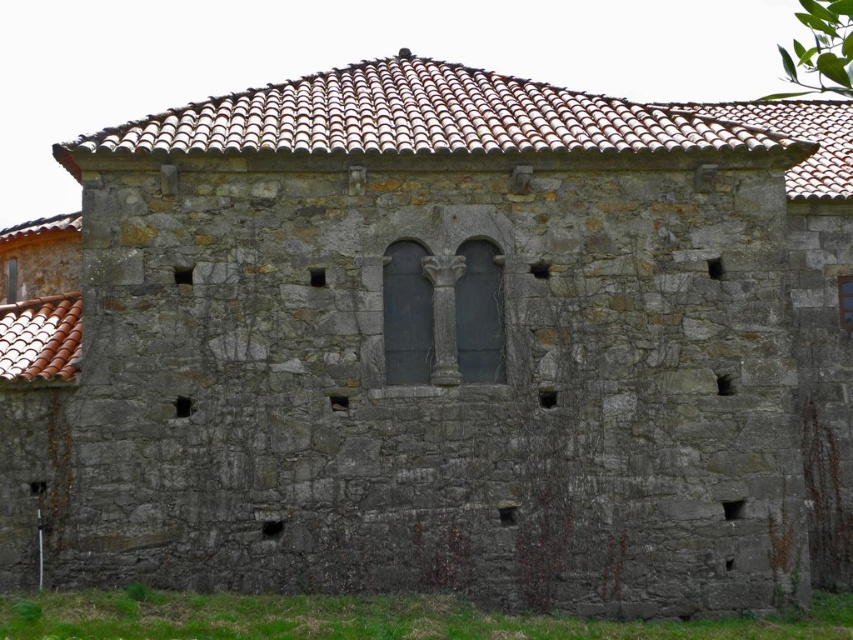
You are an architect assessing the building facade. You need to determine which object, the brown clay tiles at upper center or the smooth stone column at center, has a greater width. Based on the provided description, which one is wider?

The brown clay tiles at upper center are wider than the smooth stone column at center, as stated in the description that the brown clay tiles at upper center has a larger width.

You are standing at the entrance of the stone building and notice two points marked on the wall. The first point is at coordinates point (793, 116) and the second is at point (387, 307). Which point is closer to you?

Point (387, 307) is closer to you because it is in front of point (793, 116).

You are standing 10 meters away from the building and want to take a photo that includes both the brown clay tiles at upper center and the transparent glass window at center. Will the distance be sufficient to capture both in a single frame?

The brown clay tiles at upper center and transparent glass window at center are 7.47 meters apart. Since you are standing 10 meters away from the building, the distance is sufficient to capture both in a single frame as the separation between them is less than your distance from the building.